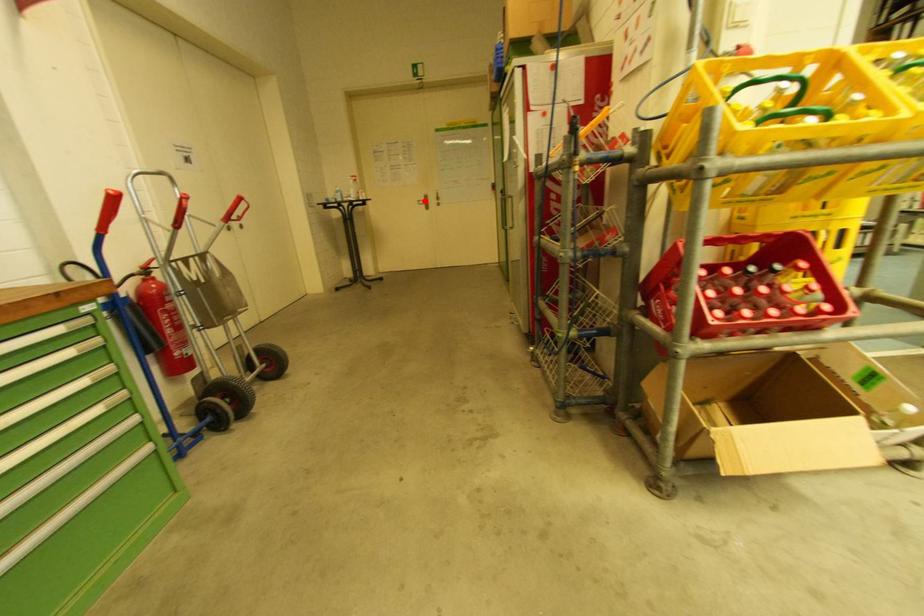
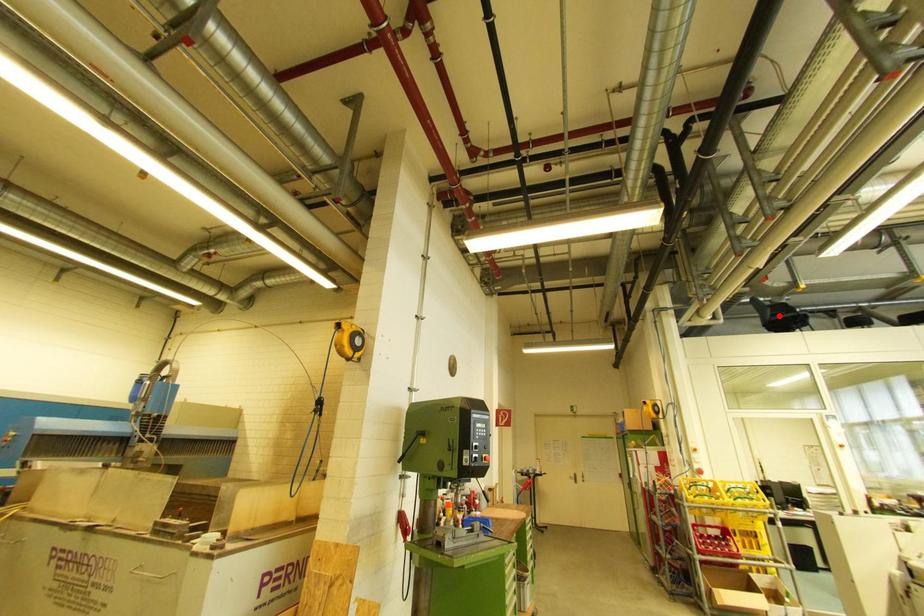
I am providing you with two images of the same scene from different viewpoints. A red point is marked on the first image and another point is marked on the second image. Are the points marked in image1 and image2 representing the same 3D position?

No